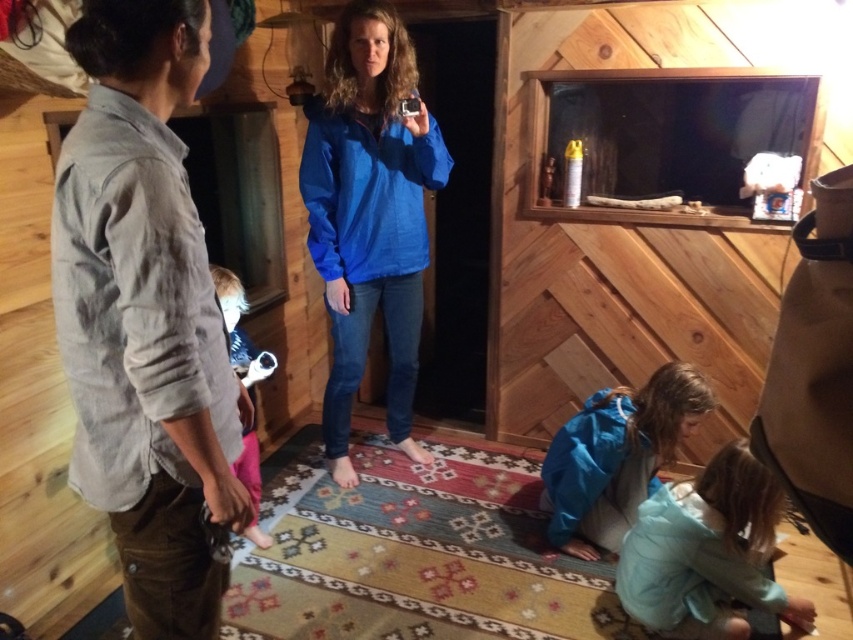
Is gray cotton shirt at left further to the viewer compared to blue fabric jacket at lower center?

That is False.

Measure the distance between gray cotton shirt at left and camera.

gray cotton shirt at left and camera are 38.80 inches apart from each other.

The image size is (853, 640). Find the location of `gray cotton shirt at left`. gray cotton shirt at left is located at coordinates (144, 316).

Does point (747, 492) come closer to viewer compared to point (548, 525)?

Yes, point (747, 492) is closer to viewer.

Does light blue fabric at lower right lie in front of blue fabric jacket at lower center?

Yes, it is in front of blue fabric jacket at lower center.

Which is behind, point (701, 550) or point (561, 484)?

Point (561, 484)

The width and height of the screenshot is (853, 640). I want to click on light blue fabric at lower right, so click(706, 552).

Who is lower down, gray cotton shirt at left or pink fabric at lower left?

pink fabric at lower left

Does point (154, 182) come farther from viewer compared to point (227, 344)?

No, it is not.

At what (x,y) coordinates should I click in order to perform the action: click on gray cotton shirt at left. Please return your answer as a coordinate pair (x, y). The height and width of the screenshot is (640, 853). Looking at the image, I should click on (144, 316).